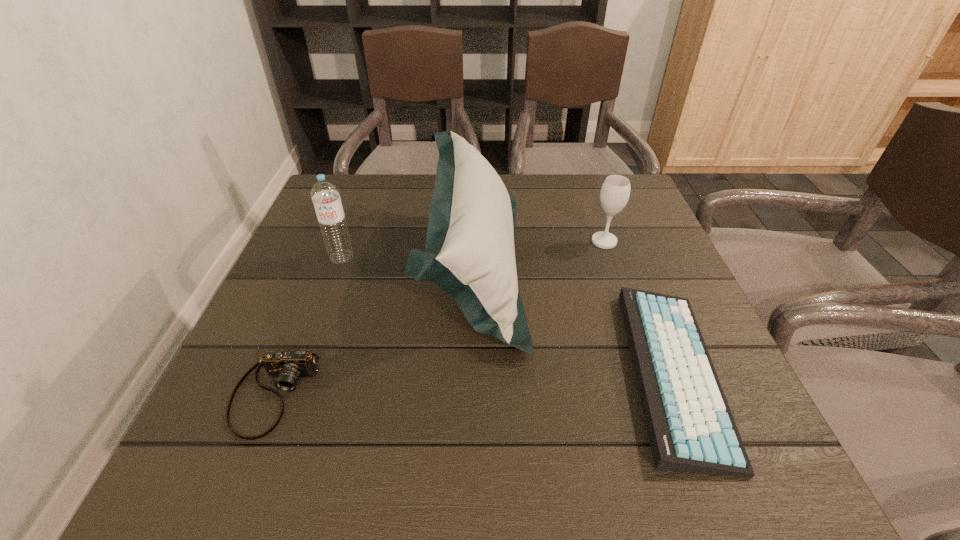
Find the location of a particular element. free location at the near edge of the desktop is located at coordinates (531, 490).

You are a GUI agent. You are given a task and a screenshot of the screen. Output one action in this format:
    pyautogui.click(x=<x>, y=<y>)
    Task: Click on the vacant space at the left edge of the desktop
    The height and width of the screenshot is (540, 960).
    Given the screenshot: What is the action you would take?
    [x=244, y=366]

Image resolution: width=960 pixels, height=540 pixels. In the image, there is a desktop. Identify the location of vacant space at the right edge. (711, 357).

The image size is (960, 540). In the image, there is a desktop. In order to click on vacant space at the far left corner in this screenshot , I will do `click(334, 180)`.

Locate an element on the screen. vacant point at the near left corner is located at coordinates (180, 478).

In the image, there is a desktop. At what (x,y) coordinates should I click in order to perform the action: click on free space at the far right corner. Please return your answer as a coordinate pair (x, y). The width and height of the screenshot is (960, 540). Looking at the image, I should click on (598, 213).

Find the location of `vacant area between the second shortest object and the water bottle`. vacant area between the second shortest object and the water bottle is located at coordinates (308, 326).

You are a GUI agent. You are given a task and a screenshot of the screen. Output one action in this format:
    pyautogui.click(x=<x>, y=<y>)
    Task: Click on the vacant space that's between the water bottle and the camera
    This screenshot has height=540, width=960.
    Given the screenshot: What is the action you would take?
    pyautogui.click(x=308, y=326)

The height and width of the screenshot is (540, 960). Identify the location of unoccupied area between the third tallest object and the second shortest object. (440, 318).

Where is `vacant space that is in between the third tallest object and the fourth tallest object`? Image resolution: width=960 pixels, height=540 pixels. vacant space that is in between the third tallest object and the fourth tallest object is located at coordinates click(x=440, y=318).